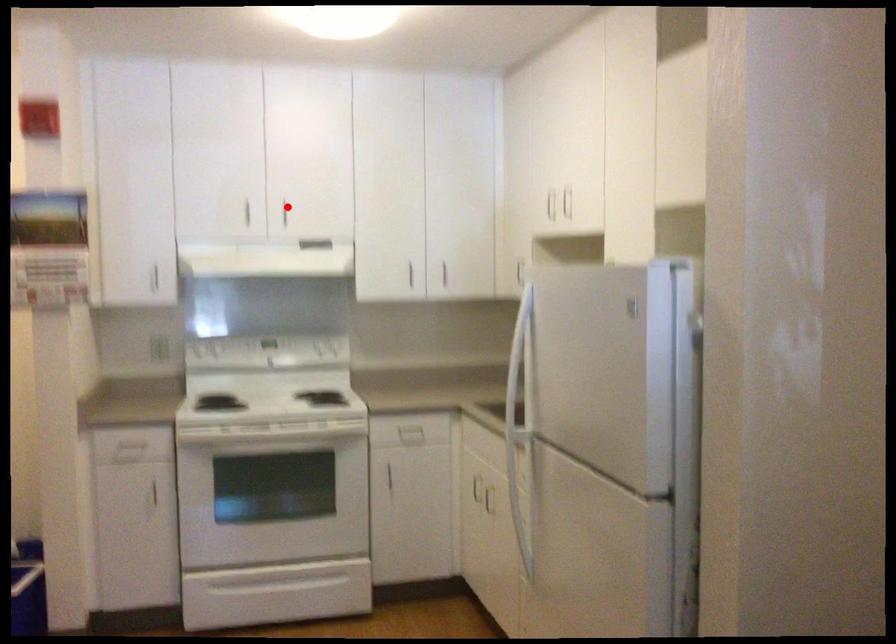
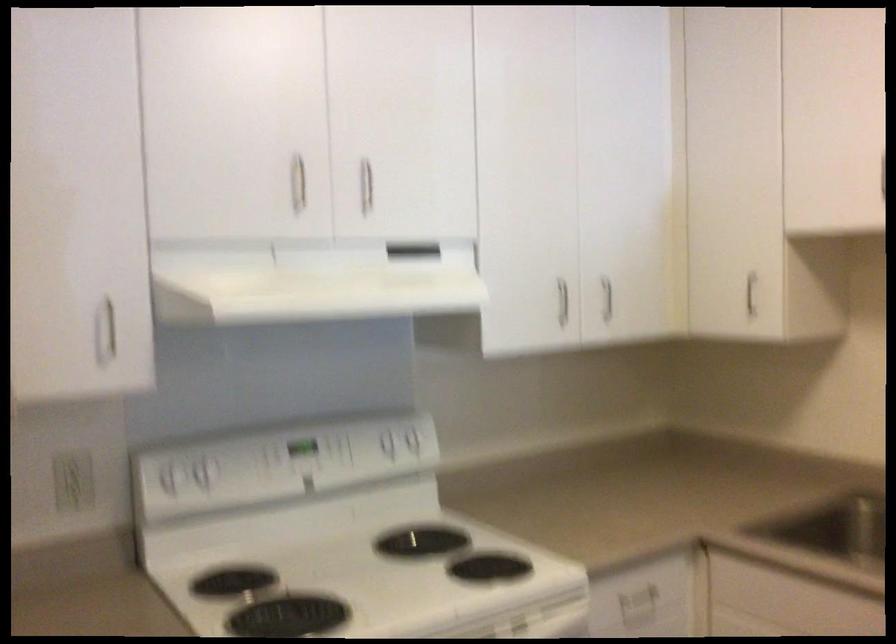
Question: I am providing you with two images of the same scene from different viewpoints. Image1 has a red point marked. In image2, the corresponding 3D location appears at what relative position? Reply with the corresponding letter.

Choices:
 (A) Closer
 (B) Farther

Answer: (A)